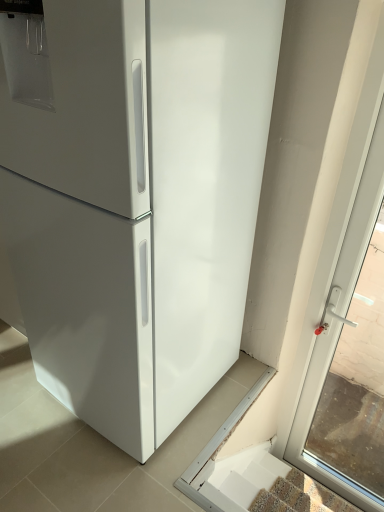
Question: Considering the positions of white glossy stairs at lower right and white plastic door handle at right in the image, is white glossy stairs at lower right bigger or smaller than white plastic door handle at right?

Choices:
 (A) big
 (B) small

Answer: (B)

Question: Is point (297, 497) closer or farther from the camera than point (347, 339)?

Choices:
 (A) closer
 (B) farther

Answer: (A)

Question: Considering the positions of white glossy stairs at lower right and white plastic door handle at right in the image, is white glossy stairs at lower right wider or thinner than white plastic door handle at right?

Choices:
 (A) thin
 (B) wide

Answer: (B)

Question: Considering the positions of point (337, 437) and point (286, 472), is point (337, 437) closer or farther from the camera than point (286, 472)?

Choices:
 (A) farther
 (B) closer

Answer: (A)

Question: From a real-world perspective, is white plastic door handle at right physically located above or below white glossy stairs at lower right?

Choices:
 (A) below
 (B) above

Answer: (B)

Question: Is white plastic door handle at right wider or thinner than white glossy stairs at lower right?

Choices:
 (A) thin
 (B) wide

Answer: (A)

Question: In terms of size, does white plastic door handle at right appear bigger or smaller than white glossy stairs at lower right?

Choices:
 (A) big
 (B) small

Answer: (A)